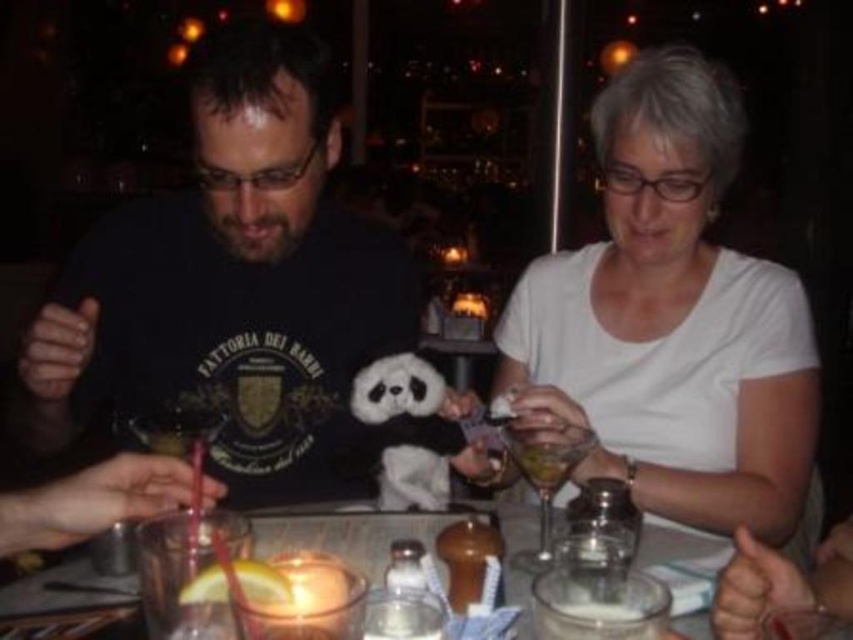
From the picture: You are a photographer trying to capture a closeup shot of the translucent glass at center without including the white matte shirt at center in the frame. Given their relative sizes, is this possible?

The white matte shirt at center has a lesser width compared to the translucent glass at center. Since the shirt is narrower, it might be possible to position the camera so that the shirt is out of frame while capturing the glass, provided there is enough space around the shirt to maneuver the camera angle.

You are a barista who needs to pour the white frothy milk at center into the translucent glass at center. Based on the scene, will the glass be able to hold all the milk without spilling?

The translucent glass at center has a larger size compared to white frothy milk at center, so it can hold all the milk without spilling.

You are a barista who needs to place a new menu board between the white frothy milk at center and the yellow citrus slice at lower left. The menu board requires a minimum of 20 centimeters of space. Can you fit it between them?

The white frothy milk at center is 22.84 centimeters from the yellow citrus slice at lower left, so yes, the menu board can be placed between them since the distance is sufficient.